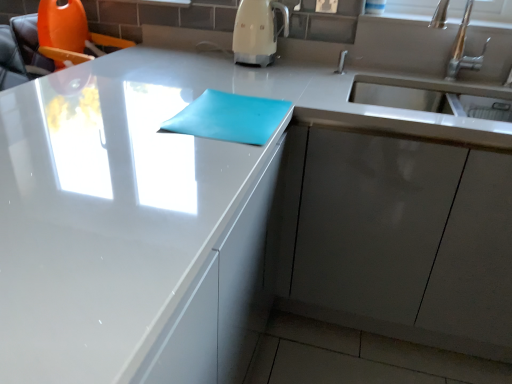
Identify the location of free space above matte blue notepad at center (from a real-world perspective). (223, 100).